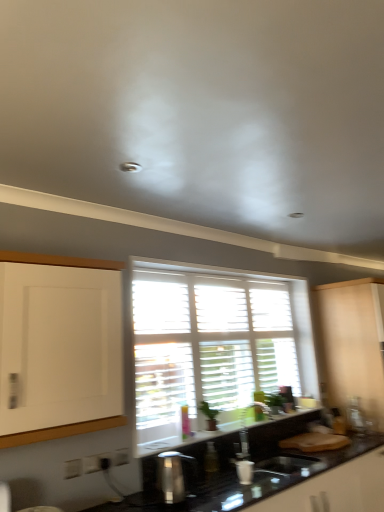
Question: Considering the relative sizes of white wooden blinds at center and beige matte cabinet at right in the image provided, is white wooden blinds at center thinner than beige matte cabinet at right?

Choices:
 (A) yes
 (B) no

Answer: (A)

Question: Does white wooden blinds at center have a smaller size compared to beige matte cabinet at right?

Choices:
 (A) yes
 (B) no

Answer: (A)

Question: From the image's perspective, is white wooden blinds at center on top of beige matte cabinet at right?

Choices:
 (A) yes
 (B) no

Answer: (A)

Question: Does white wooden blinds at center touch beige matte cabinet at right?

Choices:
 (A) yes
 (B) no

Answer: (B)

Question: Is white wooden blinds at center aimed at beige matte cabinet at right?

Choices:
 (A) no
 (B) yes

Answer: (A)

Question: Looking at their shapes, would you say beige matte cabinet at right is wider or thinner than white wooden blinds at center?

Choices:
 (A) thin
 (B) wide

Answer: (B)

Question: Which is correct: beige matte cabinet at right is inside white wooden blinds at center, or outside of it?

Choices:
 (A) inside
 (B) outside

Answer: (B)

Question: From a real-world perspective, is beige matte cabinet at right above or below white wooden blinds at center?

Choices:
 (A) below
 (B) above

Answer: (A)

Question: Does point (367, 415) appear closer or farther from the camera than point (238, 413)?

Choices:
 (A) farther
 (B) closer

Answer: (A)

Question: Is black glossy countertop at lower center inside the boundaries of metallic silver toaster at right, the second appliance in the front-to-back sequence, or outside?

Choices:
 (A) outside
 (B) inside

Answer: (A)

Question: Considering the positions of black glossy countertop at lower center and metallic silver toaster at right, the second appliance in the front-to-back sequence, in the image, is black glossy countertop at lower center taller or shorter than metallic silver toaster at right, the second appliance in the front-to-back sequence,?

Choices:
 (A) short
 (B) tall

Answer: (B)

Question: From the image's perspective, is black glossy countertop at lower center positioned above or below metallic silver toaster at right, the second appliance in the front-to-back sequence?

Choices:
 (A) below
 (B) above

Answer: (A)

Question: Considering the positions of black glossy countertop at lower center and metallic silver toaster at right, which is counted as the 1th appliance, starting from the back, in the image, is black glossy countertop at lower center wider or thinner than metallic silver toaster at right, which is counted as the 1th appliance, starting from the back,?

Choices:
 (A) wide
 (B) thin

Answer: (A)

Question: In terms of size, does black glossy countertop at lower center appear bigger or smaller than metallic silver soap dispenser at lower center, the first appliance positioned from the front?

Choices:
 (A) small
 (B) big

Answer: (B)

Question: From the image's perspective, is black glossy countertop at lower center positioned above or below metallic silver soap dispenser at lower center, marked as the first appliance in a left-to-right arrangement?

Choices:
 (A) above
 (B) below

Answer: (B)